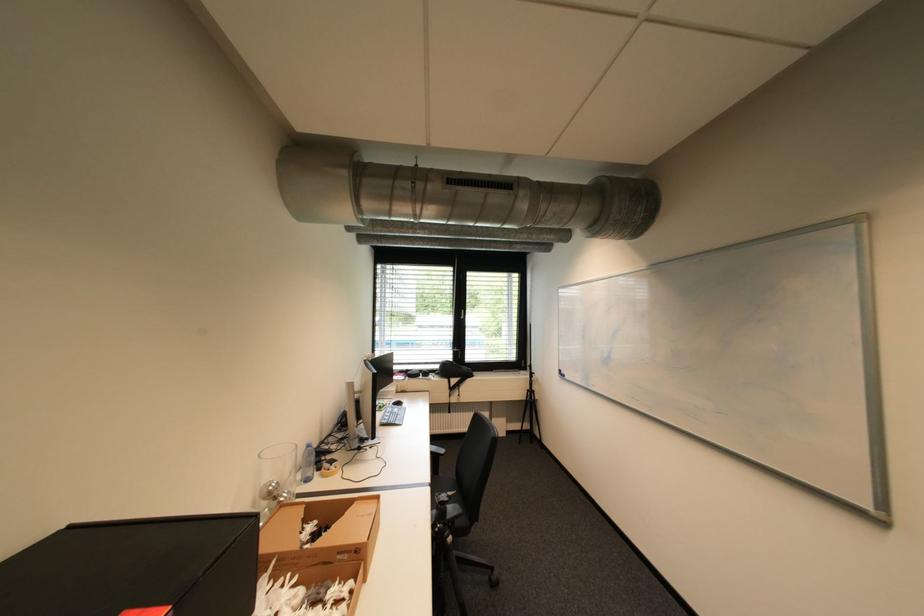
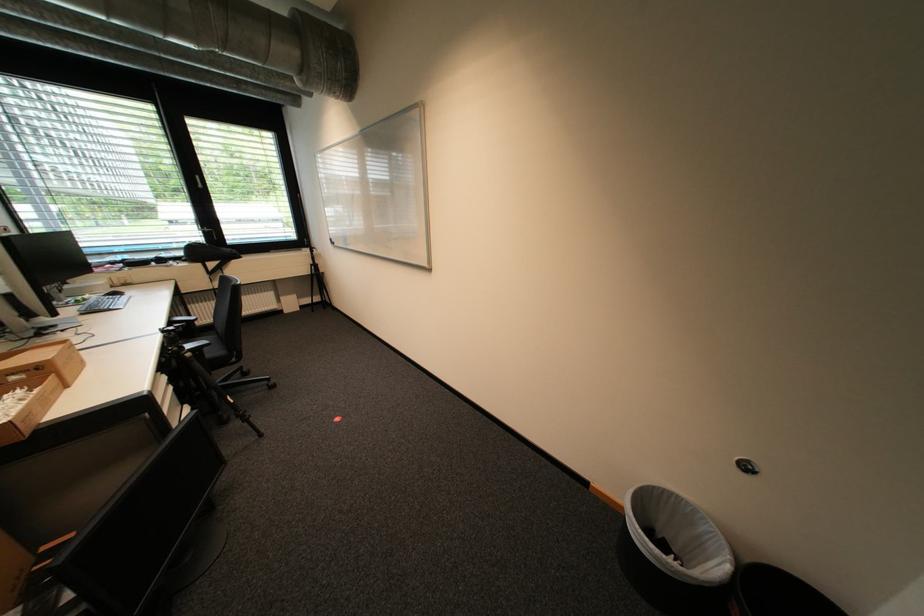
Find the pixel in the second image that matches (x=388, y=408) in the first image.

(86, 302)